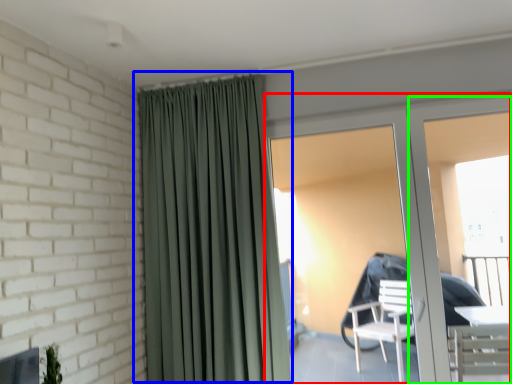
Question: Which object is positioned farthest from door (highlighted by a red box)? Select from curtain (highlighted by a blue box) and screen door (highlighted by a green box).

Choices:
 (A) curtain
 (B) screen door

Answer: (A)